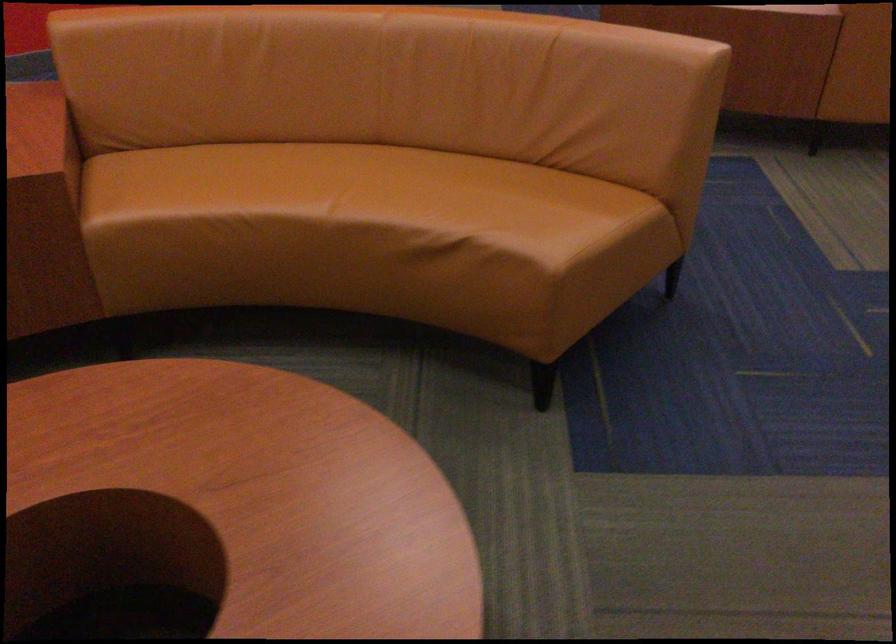
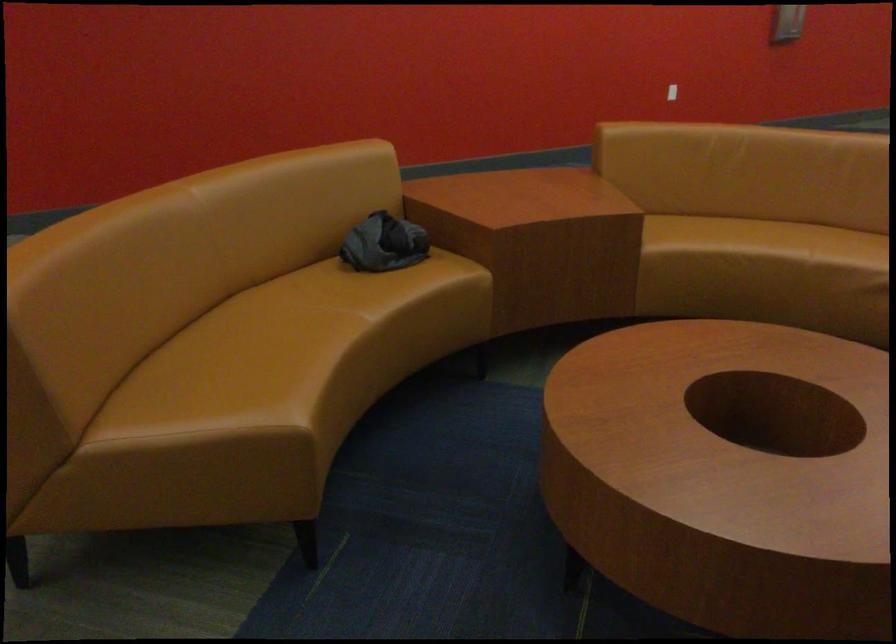
Locate, in the second image, the point that corresponds to point 202,202 in the first image.

(719, 242)